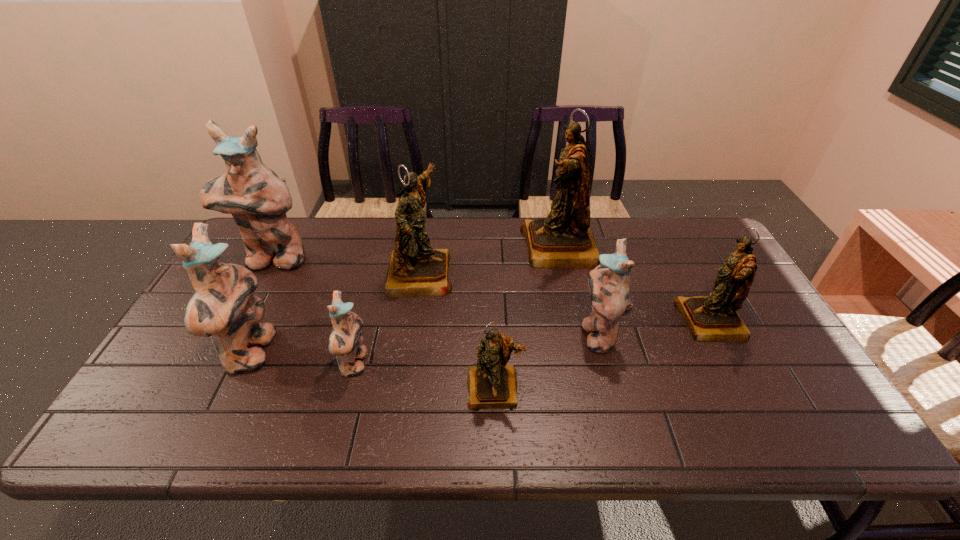
Find the location of a particular element. The height and width of the screenshot is (540, 960). vacant region located 0.330m on the front-facing side of the third biggest pink figurine is located at coordinates (456, 334).

Find the location of a particular element. This screenshot has height=540, width=960. free spot located on the front-facing side of the third biggest pink figurine is located at coordinates (509, 334).

In order to click on blank space located on the front-facing side of the second pink figurine from right to left in this screenshot , I will do `click(465, 364)`.

The height and width of the screenshot is (540, 960). I want to click on object at the near edge, so click(x=492, y=383).

Find the location of a particular element. This screenshot has height=540, width=960. object that is positioned at the right edge is located at coordinates (709, 318).

The width and height of the screenshot is (960, 540). I want to click on object that is at the far left corner, so coord(257,198).

What are the coordinates of `vacant space at the far edge of the desktop` in the screenshot? It's located at (495, 243).

The width and height of the screenshot is (960, 540). I want to click on vacant space at the near edge of the desktop, so click(x=746, y=445).

I want to click on vacant area at the left edge, so click(x=177, y=351).

Identify the location of vacant space at the right edge. (782, 364).